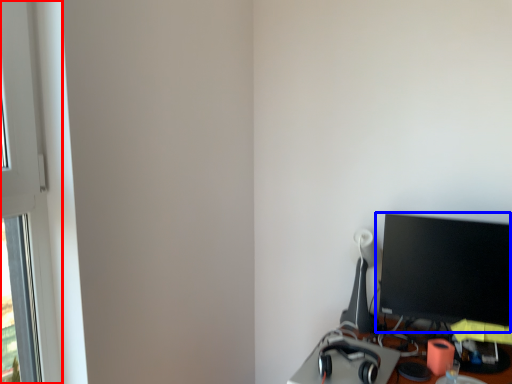
Question: Which of the following is the closest to the observer, window frame (highlighted by a red box) or computer monitor (highlighted by a blue box)?

Choices:
 (A) window frame
 (B) computer monitor

Answer: (A)